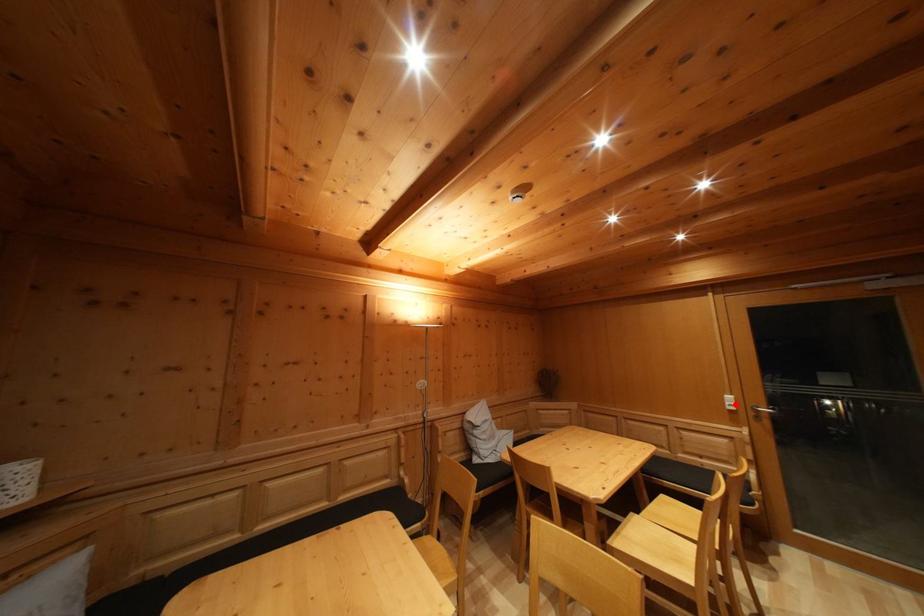
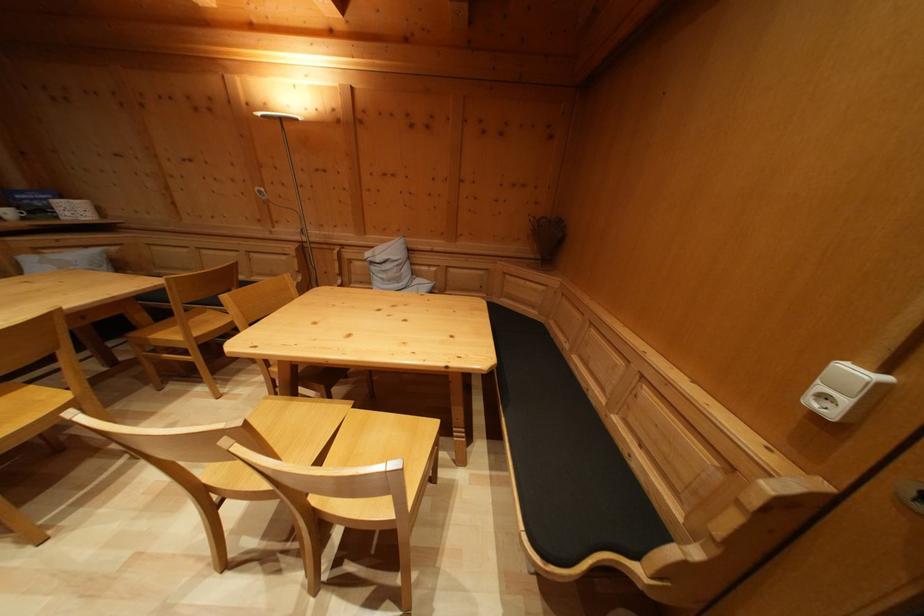
Find the pixel in the second image that matches the highlighted location in the first image.

(859, 379)